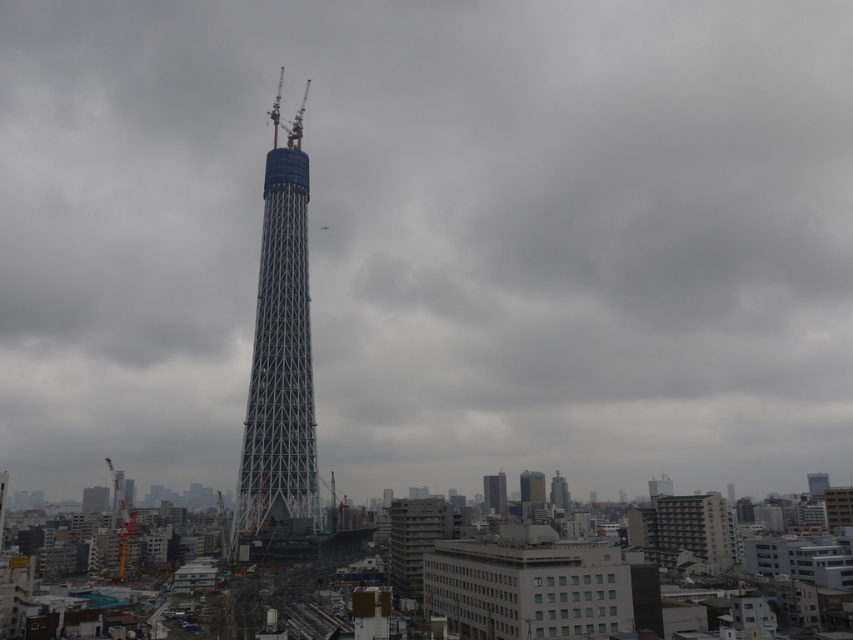
You are a construction worker standing at the base of the silver metallic tower at center. Your supervisor asks you to estimate how far you are from the tower. What would be your best guess?

The distance of silver metallic tower at center from viewer is 206.63 meters, so the best guess would be approximately 207 meters away.

You are an architect reviewing a construction site. You observe the silver metallic tower at center and the metallic silver tower at center in the image. Which one is taller?

The silver metallic tower at center is much taller than the metallic silver tower at center according to the description.